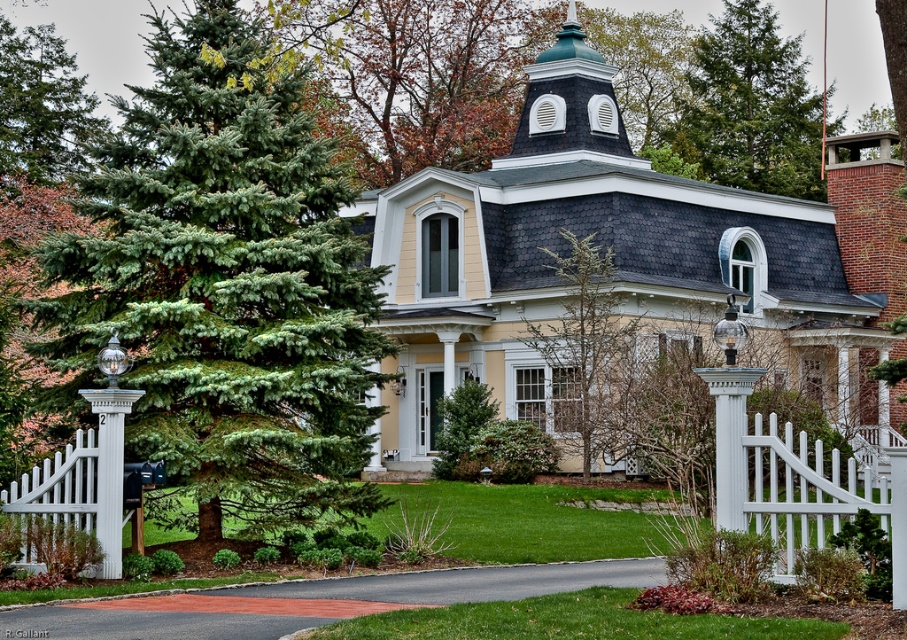
Between green evergreen tree at upper center and white painted wood post at center, which one is positioned higher?

Positioned higher is green evergreen tree at upper center.

Which is below, green evergreen tree at upper center or white painted wood post at center?

white painted wood post at center

The width and height of the screenshot is (907, 640). Find the location of `green evergreen tree at upper center`. green evergreen tree at upper center is located at coordinates (749, 106).

Measure the distance from green fir tree at center to white painted wood post at center.

green fir tree at center is 51.30 feet away from white painted wood post at center.

Does green fir tree at center have a larger size compared to white painted wood post at center?

Yes, green fir tree at center is bigger than white painted wood post at center.

Measure the distance between point (x=301, y=195) and camera.

They are 43.43 meters apart.

Find the location of a particular element. green fir tree at center is located at coordinates (225, 284).

Between yellow wood house at center and green evergreen tree at upper center, which one appears on the right side from the viewer's perspective?

green evergreen tree at upper center

Who is shorter, yellow wood house at center or green evergreen tree at upper center?

green evergreen tree at upper center

This screenshot has height=640, width=907. Find the location of `yellow wood house at center`. yellow wood house at center is located at coordinates (620, 260).

Find the location of a particular element. yellow wood house at center is located at coordinates (620, 260).